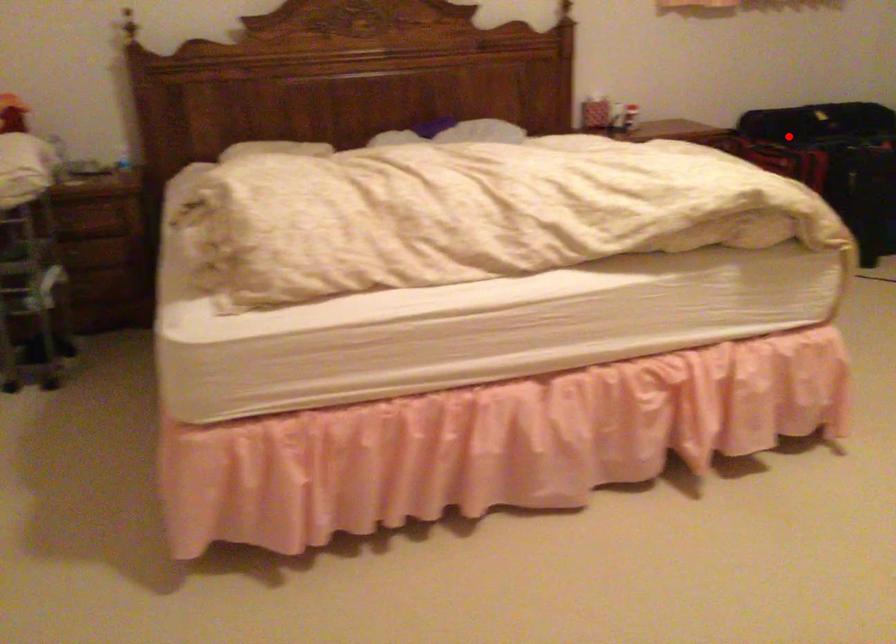
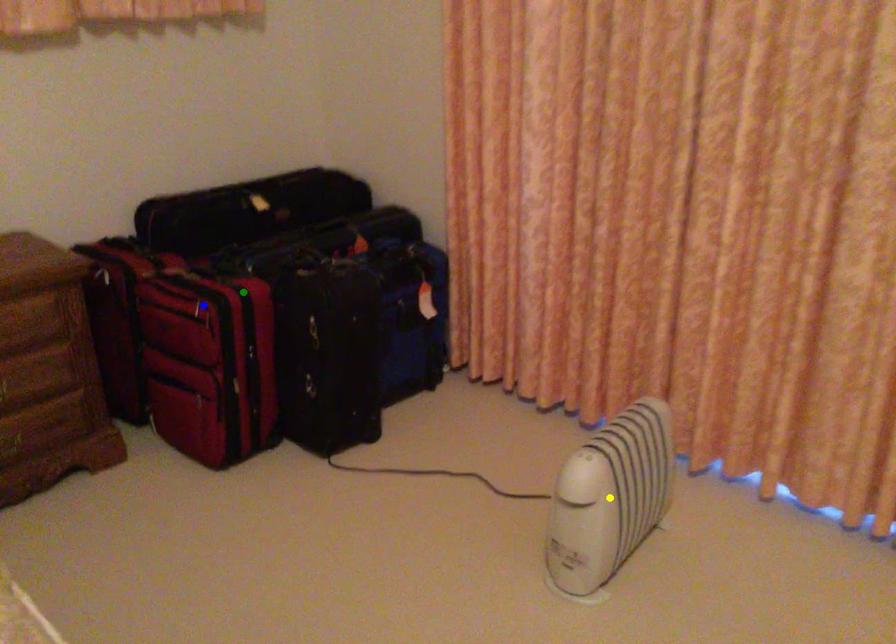
Question: I am providing you with two images of the same scene from different viewpoints. A red point is marked on the first image. You are given multiple points on the second image. In image 2, which mark is for the same physical point as the one in image 1?

Choices:
 (A) yellow point
 (B) green point
 (C) blue point

Answer: (C)